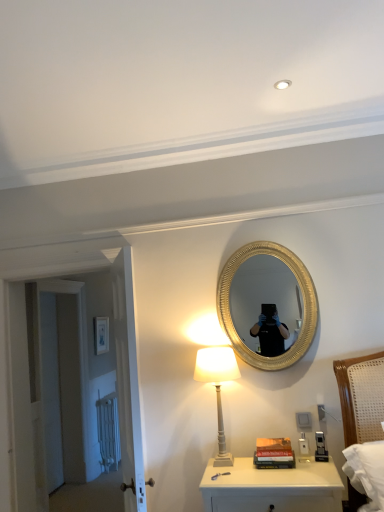
Measure the distance between white glossy nightstand at lower center and camera.

white glossy nightstand at lower center and camera are 7.18 feet apart from each other.

What do you see at coordinates (101, 335) in the screenshot?
I see `matte white picture frame at upper left` at bounding box center [101, 335].

The image size is (384, 512). What do you see at coordinates (217, 387) in the screenshot? I see `white painted wood table lamp at lower center` at bounding box center [217, 387].

At what (x,y) coordinates should I click in order to perform the action: click on white painted wood table lamp at lower center. Please return your answer as a coordinate pair (x, y). The width and height of the screenshot is (384, 512). Looking at the image, I should click on (217, 387).

Identify the location of white glossy nightstand at lower center. The width and height of the screenshot is (384, 512). (273, 487).

Who is taller, hardcover books at center or matte white picture frame at upper left?

matte white picture frame at upper left.

From a real-world perspective, between hardcover books at center and matte white picture frame at upper left, who is vertically higher?

In real-world perspective, matte white picture frame at upper left is above.

Is hardcover books at center oriented away from matte white picture frame at upper left?

No, hardcover books at center is not facing away from matte white picture frame at upper left.

Is hardcover books at center inside or outside of matte white picture frame at upper left?

hardcover books at center is not inside matte white picture frame at upper left, it's outside.

There is a white glossy nightstand at lower center. Identify the location of table lamp above it (from a real-world perspective). (217, 387).

Based on their positions, is white glossy nightstand at lower center located to the left or right of white painted wood table lamp at lower center?

From the image, it's evident that white glossy nightstand at lower center is to the right of white painted wood table lamp at lower center.

Could you tell me if white glossy nightstand at lower center is facing white painted wood table lamp at lower center?

No, white glossy nightstand at lower center is not oriented towards white painted wood table lamp at lower center.

Which object is wider, white matte door at left, the second door from the front, or white painted wood table lamp at lower center?

white painted wood table lamp at lower center.

Which point is more forward, (48, 351) or (225, 362)?

Point (225, 362)

I want to click on the 2nd door behind when counting from the white painted wood table lamp at lower center, so click(51, 391).

Is white painted wood table lamp at lower center inside the boundaries of white glossy nightstand at lower center, or outside?

white painted wood table lamp at lower center is outside white glossy nightstand at lower center.

Considering their positions, is white painted wood table lamp at lower center located in front of or behind white glossy nightstand at lower center?

A: In the image, white painted wood table lamp at lower center appears behind white glossy nightstand at lower center.

Can you tell me how much white painted wood table lamp at lower center and white glossy nightstand at lower center differ in facing direction?

0.567 degrees separate the facing orientations of white painted wood table lamp at lower center and white glossy nightstand at lower center.

Looking at this image, does white painted wood table lamp at lower center have a greater width compared to white glossy nightstand at lower center?

In fact, white painted wood table lamp at lower center might be narrower than white glossy nightstand at lower center.

Could you tell me if white matte door at left, the 1th door when ordered from back to front, is facing white wooden door at left, which is counted as the 1th door, starting from the front?

No.

How different are the orientations of white matte door at left, the second door from the front, and white wooden door at left, which is counted as the 1th door, starting from the front, in degrees?

The facing directions of white matte door at left, the second door from the front, and white wooden door at left, which is counted as the 1th door, starting from the front, are 92 degrees apart.

Considering the relative positions of white matte door at left, the second door from the front, and white wooden door at left, which is counted as the 1th door, starting from the front, in the image provided, is white matte door at left, the second door from the front, to the left of white wooden door at left, which is counted as the 1th door, starting from the front, from the viewer's perspective?

Yes, white matte door at left, the second door from the front, is to the left of white wooden door at left, which is counted as the 1th door, starting from the front.

Can you see white matte door at left, the second door from the front, touching white wooden door at left, which is counted as the 1th door, starting from the front?

No, white matte door at left, the second door from the front, is not next to white wooden door at left, which is counted as the 1th door, starting from the front.

Between hardcover books at center and white glossy nightstand at lower center, which one is positioned behind?

hardcover books at center is further from the camera.

I want to click on nightstand below the hardcover books at center (from a real-world perspective), so click(273, 487).

Which is more to the left, hardcover books at center or white glossy nightstand at lower center?

white glossy nightstand at lower center is more to the left.

Can hardcover books at center be found inside white matte door at left, the second door from the front?

No, hardcover books at center is not surrounded by white matte door at left, the second door from the front.

From the picture: Is white matte door at left, the 1th door when ordered from back to front, facing towards hardcover books at center?

No, white matte door at left, the 1th door when ordered from back to front, is not aimed at hardcover books at center.

From the image's perspective, is white matte door at left, the 1th door when ordered from back to front, on top of hardcover books at center?

No, from the image's perspective, white matte door at left, the 1th door when ordered from back to front, is not above hardcover books at center.

The width and height of the screenshot is (384, 512). Identify the location of book beneath the matte white picture frame at upper left (from a real-world perspective). (274, 453).

In order to click on table lamp behind the white glossy nightstand at lower center in this screenshot , I will do `click(217, 387)`.

Based on their spatial positions, is white glossy nightstand at lower center or white painted wood table lamp at lower center closer to white matte door at left, the 1th door when ordered from back to front?

white painted wood table lamp at lower center lies closer to white matte door at left, the 1th door when ordered from back to front, than the other object.

Based on their spatial positions, is hardcover books at center or matte white picture frame at upper left further from white glossy nightstand at lower center?

matte white picture frame at upper left is positioned further to the anchor white glossy nightstand at lower center.

In the scene shown: Which object lies nearer to the anchor point white painted wood table lamp at lower center, matte white picture frame at upper left or white wooden door at left, which appears as the 2th door when viewed from the back?

Among the two, white wooden door at left, which appears as the 2th door when viewed from the back, is located nearer to white painted wood table lamp at lower center.

From the picture: Looking at the image, which one is located further to hardcover books at center, matte white picture frame at upper left or white painted wood table lamp at lower center?

matte white picture frame at upper left lies further to hardcover books at center than the other object.

Considering their positions, is hardcover books at center positioned further to white painted wood table lamp at lower center than matte white picture frame at upper left?

The object further to white painted wood table lamp at lower center is matte white picture frame at upper left.

Looking at this image, considering their positions, is white painted wood table lamp at lower center positioned further to white matte door at left, the 1th door when ordered from back to front, than white wooden door at left, which appears as the 2th door when viewed from the back?

white painted wood table lamp at lower center is positioned further to the anchor white matte door at left, the 1th door when ordered from back to front.

Estimate the real-world distances between objects in this image. Which object is closer to white wooden door at left, which is counted as the 1th door, starting from the front, matte white picture frame at upper left or white painted wood table lamp at lower center?

matte white picture frame at upper left lies closer to white wooden door at left, which is counted as the 1th door, starting from the front, than the other object.

In the scene shown: Looking at the image, which one is located closer to white wooden door at left, which appears as the 2th door when viewed from the back, white matte door at left, the 1th door when ordered from back to front, or hardcover books at center?

white matte door at left, the 1th door when ordered from back to front, is closer to white wooden door at left, which appears as the 2th door when viewed from the back.

Locate an element on the screen. nightstand between white wooden door at left, which appears as the 2th door when viewed from the back, and hardcover books at center, in the horizontal direction is located at coordinates (273, 487).

Locate an element on the screen. The width and height of the screenshot is (384, 512). door located between white matte door at left, the second door from the front, and white painted wood table lamp at lower center in the left-right direction is located at coordinates (78, 374).

You are a GUI agent. You are given a task and a screenshot of the screen. Output one action in this format:
    pyautogui.click(x=<x>, y=<y>)
    Task: Click on the table lamp between white matte door at left, the 1th door when ordered from back to front, and hardcover books at center
    
    Given the screenshot: What is the action you would take?
    pyautogui.click(x=217, y=387)

Locate an element on the screen. Image resolution: width=384 pixels, height=512 pixels. table lamp positioned between white glossy nightstand at lower center and matte white picture frame at upper left from near to far is located at coordinates (217, 387).